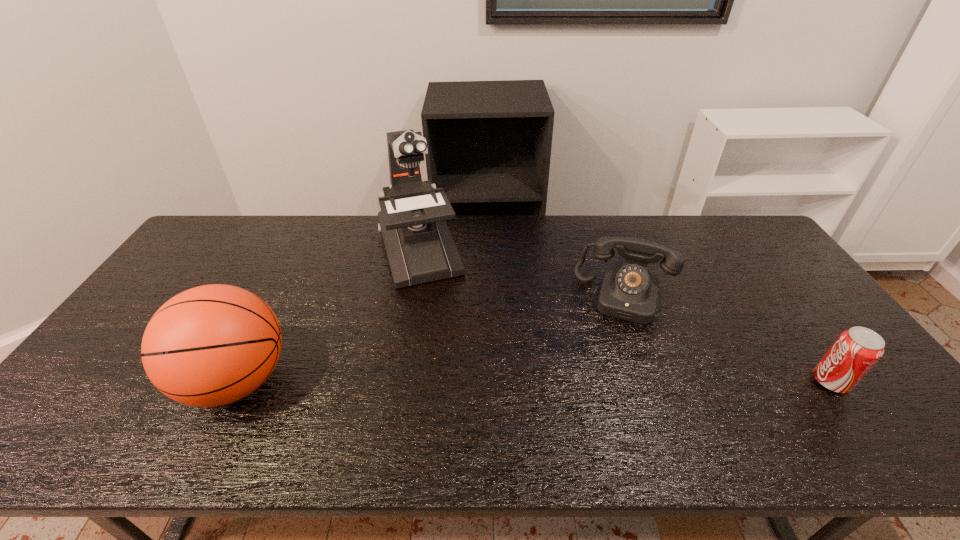
Locate an element on the screen. free spot on the desktop that is between the basketball and the soda can and is positioned through the eyepieces of the third object from right to left is located at coordinates (466, 381).

You are a GUI agent. You are given a task and a screenshot of the screen. Output one action in this format:
    pyautogui.click(x=<x>, y=<y>)
    Task: Click on the free spot on the desktop that is between the leftmost object and the rightmost object and is positioned on the dial of the second object from right to left
    The height and width of the screenshot is (540, 960).
    Given the screenshot: What is the action you would take?
    pyautogui.click(x=611, y=381)